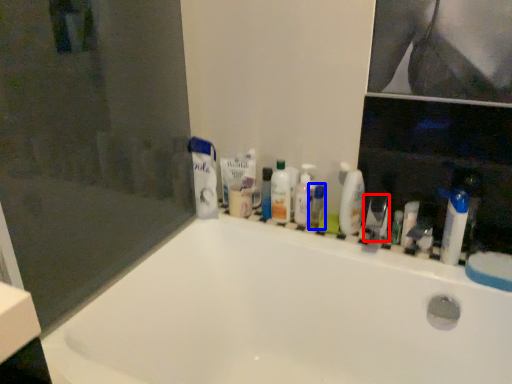
Question: Which object is closer to the camera taking this photo, toiletry (highlighted by a red box) or mouthwash (highlighted by a blue box)?

Choices:
 (A) toiletry
 (B) mouthwash

Answer: (A)